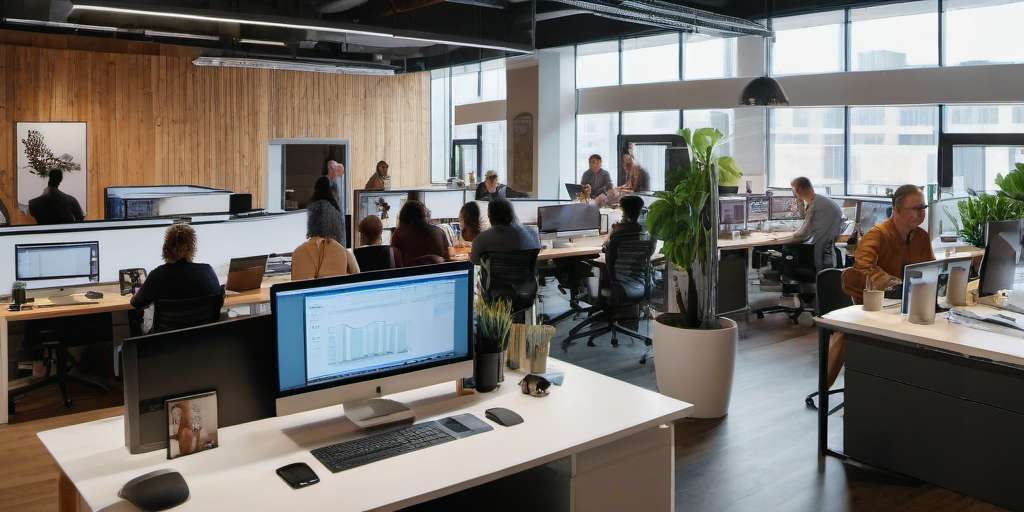
The width and height of the screenshot is (1024, 512). I want to click on upper windows, so click(485, 78), click(464, 85), click(612, 63), click(663, 62), click(724, 57), click(795, 54), click(894, 52), click(976, 50).